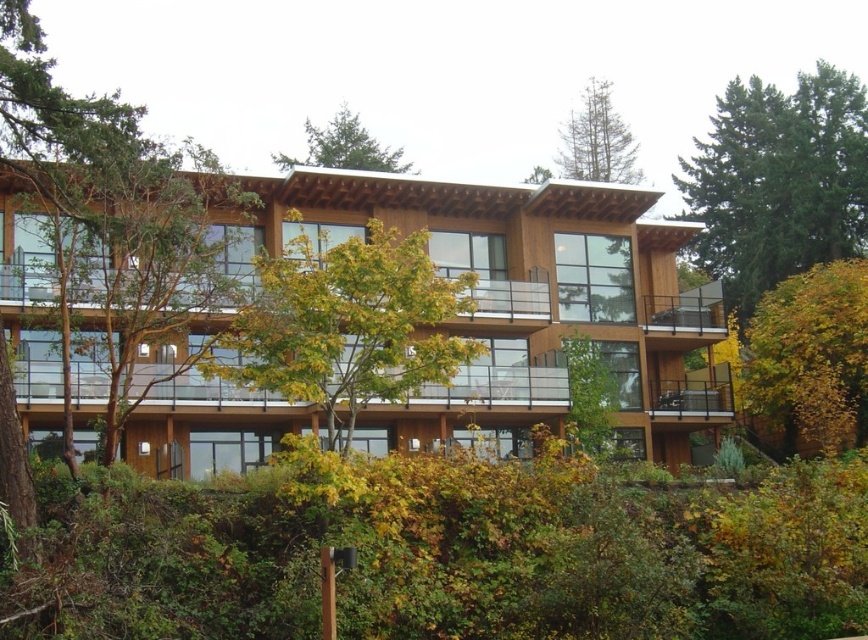
Question: Which object is the closest to the green needle-like tree at upper center?

Choices:
 (A) green coniferous tree at upper right
 (B) yellow leafy tree at lower right
 (C) green wood tree at left

Answer: (A)

Question: Is green wood tree at left to the left of yellow leafy tree at lower right from the viewer's perspective?

Choices:
 (A) no
 (B) yes

Answer: (B)

Question: Is green leafy tree at center positioned before green needle-like tree at upper center?

Choices:
 (A) no
 (B) yes

Answer: (B)

Question: Is green wood tree at left smaller than green needle-like tree at upper center?

Choices:
 (A) yes
 (B) no

Answer: (A)

Question: Among these points, which one is farthest from the camera?

Choices:
 (A) (290, 164)
 (B) (378, 342)

Answer: (A)

Question: Estimate the real-world distances between objects in this image. Which object is farther from the green needle-like tree at upper center?

Choices:
 (A) yellow leafy tree at lower right
 (B) green wood tree at left
 (C) green leafy hedge at lower center
 (D) green coniferous tree at upper right

Answer: (C)